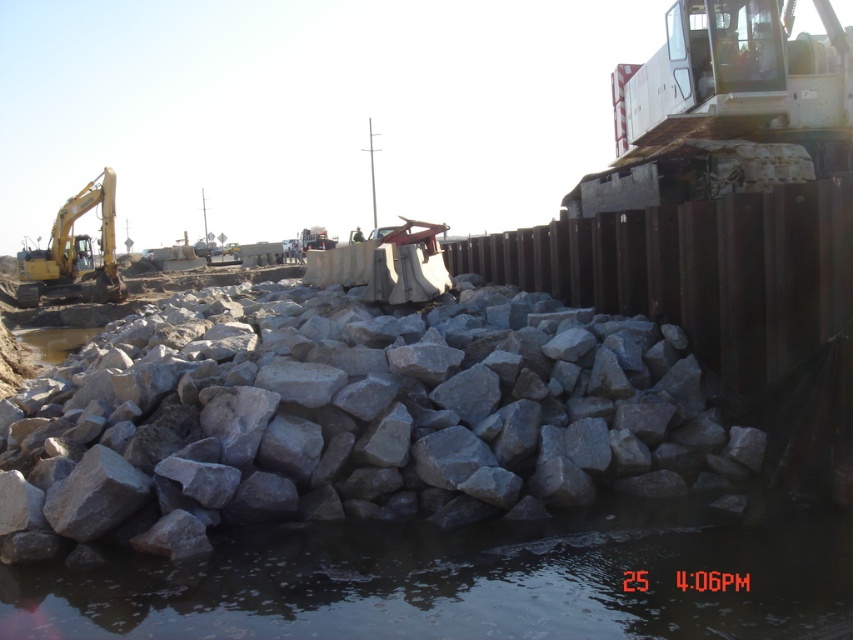
Is gray rough stone at center wider than clear water at lower center?

No.

Can you confirm if gray rough stone at center is smaller than clear water at lower center?

Yes.

At what (x,y) coordinates should I click in order to perform the action: click on gray rough stone at center. Please return your answer as a coordinate pair (x, y). This screenshot has height=640, width=853. Looking at the image, I should click on (347, 424).

Can you confirm if clear water at lower center is positioned to the right of yellow metallic excavator at left?

Indeed, clear water at lower center is positioned on the right side of yellow metallic excavator at left.

Can you confirm if clear water at lower center is positioned below yellow metallic excavator at left?

Indeed, clear water at lower center is positioned under yellow metallic excavator at left.

Describe the element at coordinates (468, 579) in the screenshot. I see `clear water at lower center` at that location.

What are the coordinates of `clear water at lower center` in the screenshot? It's located at (468, 579).

Is gray rough stone at center wider than yellow metallic excavator at left?

Incorrect, gray rough stone at center's width does not surpass yellow metallic excavator at left's.

Does point (422, 365) come behind point (102, 202)?

No, it is in front of (102, 202).

Where is `gray rough stone at center`? The image size is (853, 640). gray rough stone at center is located at coordinates (347, 424).